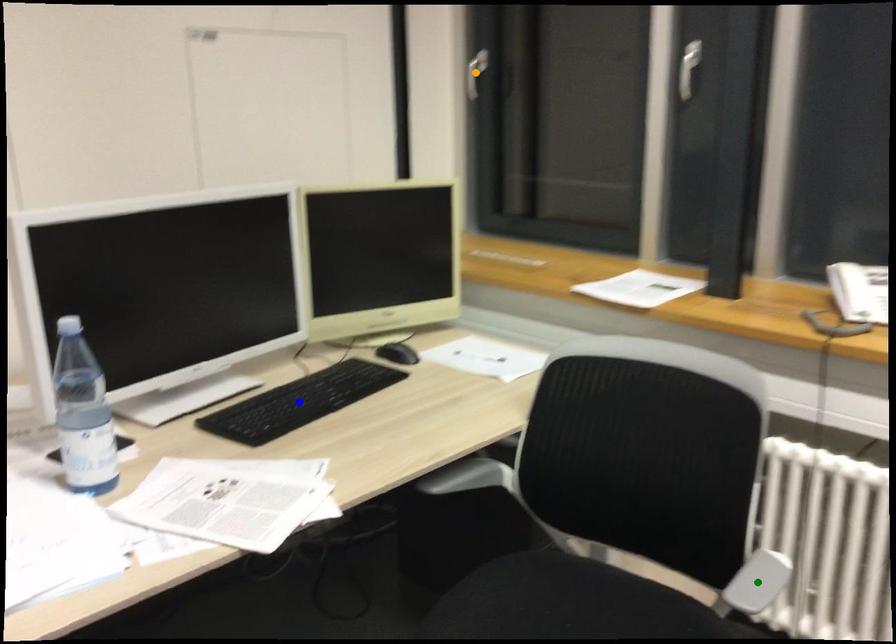
Order these from nearest to farthest:
- orange point
- green point
- blue point

green point → blue point → orange point